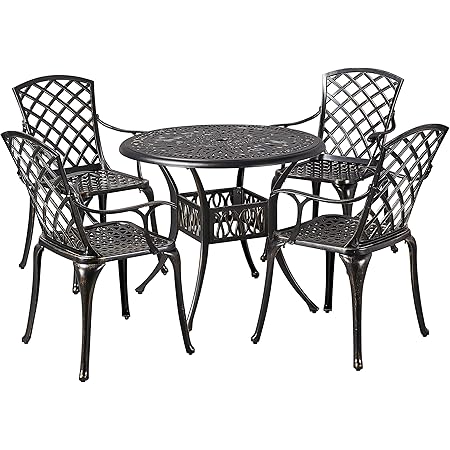
This screenshot has width=450, height=450. In order to click on backs of chairs in this screenshot , I will do `click(43, 190)`, `click(57, 128)`, `click(349, 115)`, `click(401, 190)`.